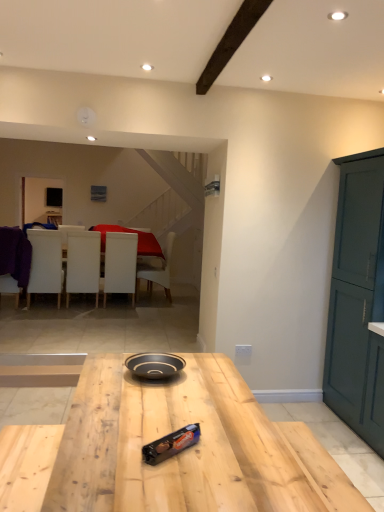
Find the location of a particular element. This screenshot has height=512, width=384. free region on the left part of matte black bowl at center is located at coordinates (107, 376).